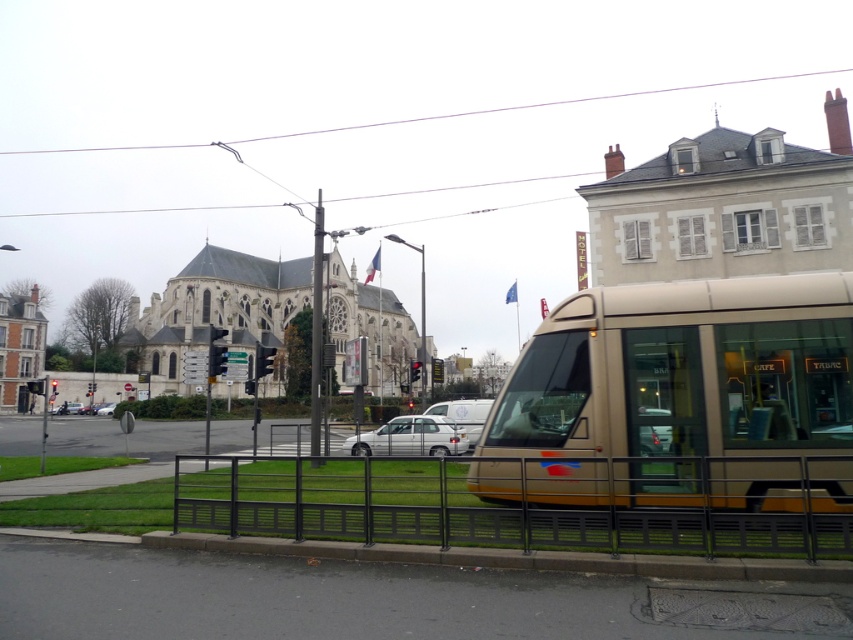
Does point (753, 516) come behind point (424, 433)?

No, (753, 516) is in front of (424, 433).

Can you confirm if metallic gray fence at lower center is positioned below white matte car at center?

Incorrect, metallic gray fence at lower center is not positioned below white matte car at center.

Is point (689, 515) positioned in front of point (416, 413)?

That is True.

Where is `metallic gray fence at lower center`? metallic gray fence at lower center is located at coordinates (527, 504).

Is gold metallic tram at center wider than metallic gray fence at lower center?

In fact, gold metallic tram at center might be narrower than metallic gray fence at lower center.

Does gold metallic tram at center have a lesser height compared to metallic gray fence at lower center?

Indeed, gold metallic tram at center has a lesser height compared to metallic gray fence at lower center.

Find the location of a particular element. This screenshot has height=640, width=853. gold metallic tram at center is located at coordinates (676, 394).

Between metallic gray fence at lower center and silver metallic sedan at center, which one has less height?

Standing shorter between the two is silver metallic sedan at center.

The width and height of the screenshot is (853, 640). Identify the location of metallic gray fence at lower center. (527, 504).